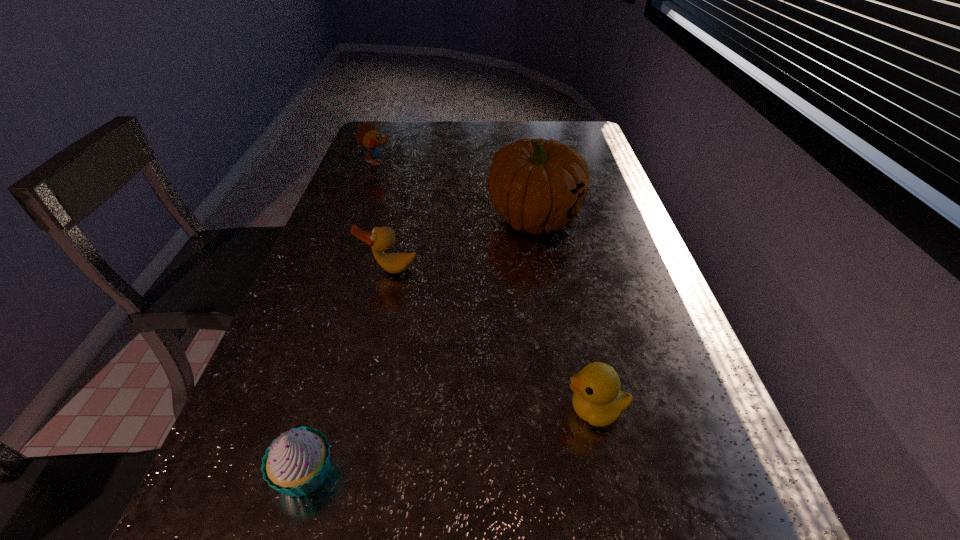
You are a GUI agent. You are given a task and a screenshot of the screen. Output one action in this format:
    pyautogui.click(x=<x>, y=<y>)
    Task: Click on the vacant space at the left edge of the desktop
    
    Given the screenshot: What is the action you would take?
    click(342, 292)

Identify the location of vacant space at the right edge. (667, 349).

This screenshot has width=960, height=540. What are the coordinates of `blank space at the far left corner of the desktop` in the screenshot? It's located at (404, 146).

In the image, there is a desktop. Identify the location of vacant space at the far right corner. This screenshot has width=960, height=540. 567,136.

Identify the location of vacant area that lies between the cupcake and the fourth nearest object. The width and height of the screenshot is (960, 540). (420, 345).

Where is `free space between the rightmost duck and the tallest object`? This screenshot has height=540, width=960. free space between the rightmost duck and the tallest object is located at coordinates (565, 314).

I want to click on free area in between the second farthest object and the farthest object, so click(x=456, y=191).

This screenshot has height=540, width=960. I want to click on unoccupied area between the nearest object and the third farthest object, so click(x=348, y=371).

At what (x,y) coordinates should I click in order to perform the action: click on vacant area between the tallest object and the farthest duck. Please return your answer as a coordinate pair (x, y). Looking at the image, I should click on (456, 191).

I want to click on free point between the leftmost duck and the pumpkin, so click(456, 191).